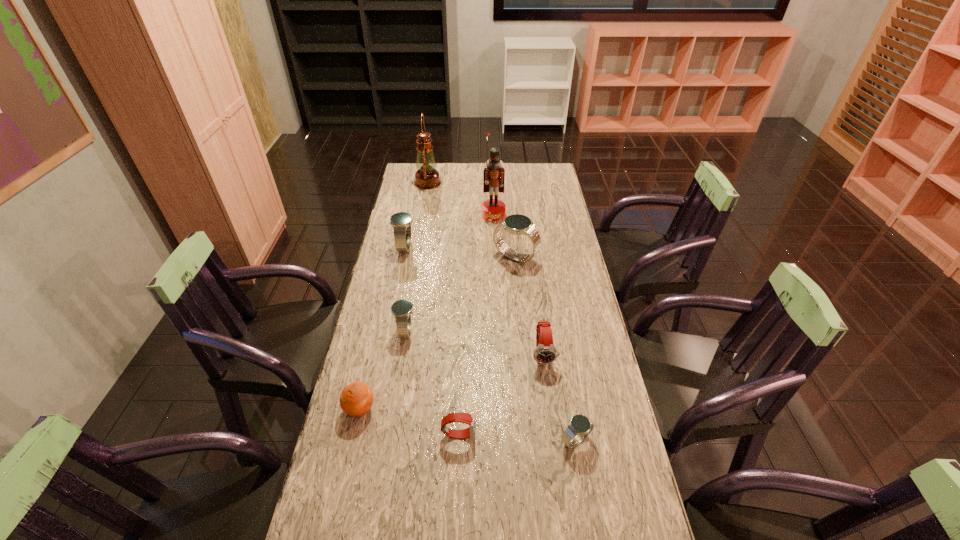
Where is `watch that is the closest to the nutcracker`? Image resolution: width=960 pixels, height=540 pixels. watch that is the closest to the nutcracker is located at coordinates (517, 224).

I want to click on watch that is the third closest to the third smallest blue watch, so click(x=545, y=352).

In order to click on blue watch identified as the closest to the orange in this screenshot , I will do `click(402, 309)`.

Identify which blue watch is the closest to the nearer red watch. Please provide its 2D coordinates. Your answer should be formatted as a tuple, i.e. [(x, y)], where the tuple contains the x and y coordinates of a point satisfying the conditions above.

[(580, 426)]

Where is `vacant point that satisfies the following two spatial constraints: 1. on the front-facing side of the second farthest object; 2. on the face of the fourth watch from right to left`? Image resolution: width=960 pixels, height=540 pixels. vacant point that satisfies the following two spatial constraints: 1. on the front-facing side of the second farthest object; 2. on the face of the fourth watch from right to left is located at coordinates (502, 434).

Where is `free spot that satisfies the following two spatial constraints: 1. on the front-facing side of the second farthest object; 2. on the right side of the smallest blue watch`? This screenshot has height=540, width=960. free spot that satisfies the following two spatial constraints: 1. on the front-facing side of the second farthest object; 2. on the right side of the smallest blue watch is located at coordinates (502, 440).

Image resolution: width=960 pixels, height=540 pixels. Find the location of `vacant area in the image that satisfies the following two spatial constraints: 1. on the back side of the third farthest blue watch; 2. on the left side of the orange`. vacant area in the image that satisfies the following two spatial constraints: 1. on the back side of the third farthest blue watch; 2. on the left side of the orange is located at coordinates (377, 331).

You are a GUI agent. You are given a task and a screenshot of the screen. Output one action in this format:
    pyautogui.click(x=<x>, y=<y>)
    Task: Click on the free spot that satisfies the following two spatial constraints: 1. on the front-facing side of the eighth nearest object; 2. on the right side of the biggest blue watch
    This screenshot has width=960, height=540.
    Given the screenshot: What is the action you would take?
    pyautogui.click(x=495, y=257)